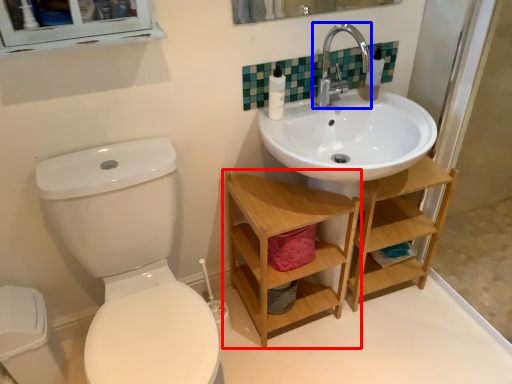
Question: Which of the following is the farthest to the observer, shelf (highlighted by a red box) or tap (highlighted by a blue box)?

Choices:
 (A) shelf
 (B) tap

Answer: (B)